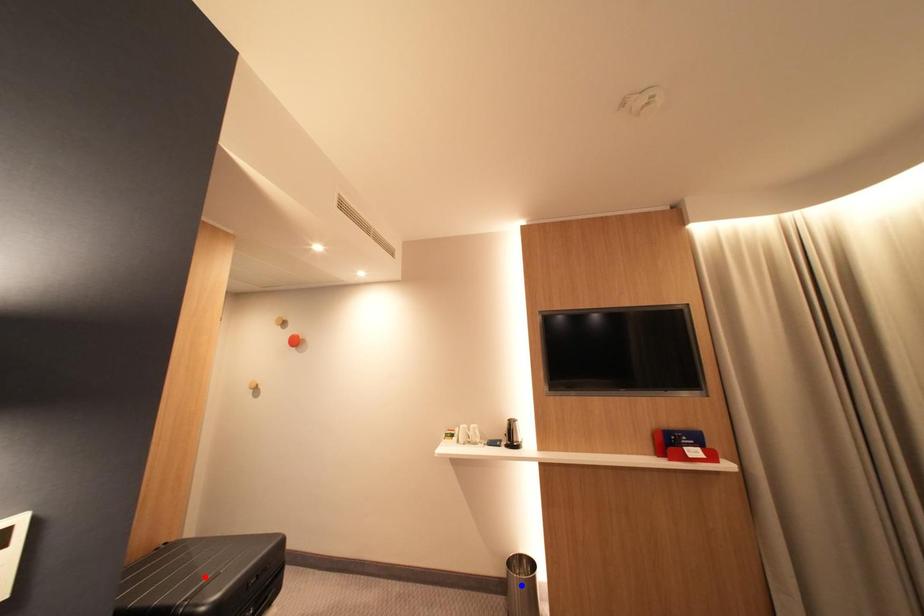
Question: Two points are marked on the image. Which point is closer to the camera?

Choices:
 (A) Blue point is closer.
 (B) Red point is closer.

Answer: (B)